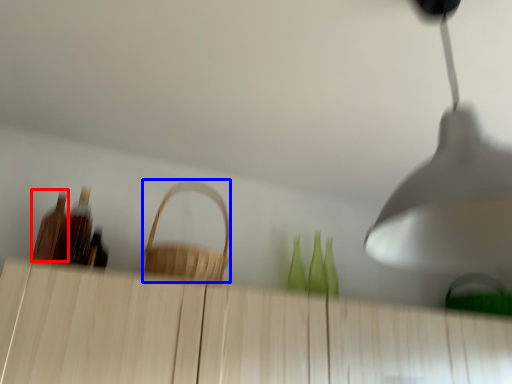
Question: Among these objects, which one is nearest to the camera, bottle (highlighted by a red box) or basket (highlighted by a blue box)?

Choices:
 (A) bottle
 (B) basket

Answer: (B)